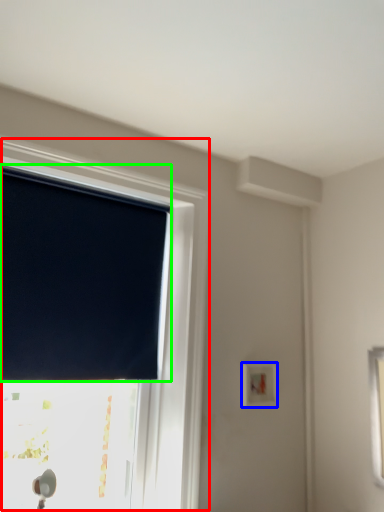
Question: Estimate the real-world distances between objects in this image. Which object is closer to window (highlighted by a red box), light switch (highlighted by a blue box) or window blind (highlighted by a green box)?

Choices:
 (A) light switch
 (B) window blind

Answer: (B)